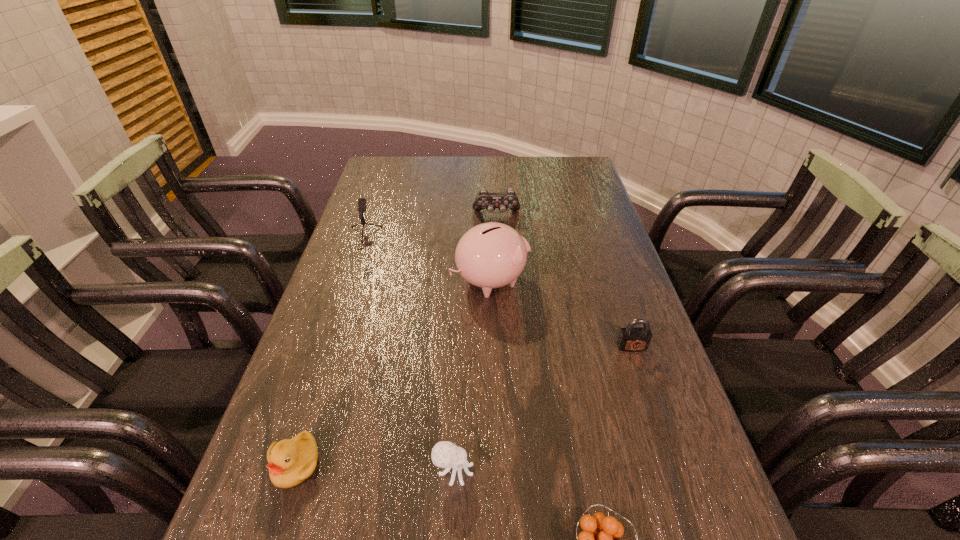
Locate an element on the screen. The image size is (960, 540). the tallest object is located at coordinates (490, 255).

This screenshot has width=960, height=540. In order to click on piggy bank in this screenshot , I will do `click(490, 255)`.

Find the location of a particular element. The image size is (960, 540). the sixth nearest object is located at coordinates 361,207.

The image size is (960, 540). Identify the location of control. (484, 199).

The width and height of the screenshot is (960, 540). Identify the location of the fourth farthest object. (631, 338).

In order to click on the rightmost object in this screenshot , I will do `click(631, 338)`.

Where is `octopus`? This screenshot has width=960, height=540. octopus is located at coordinates (445, 454).

Locate an element on the screen. This screenshot has width=960, height=540. duckling is located at coordinates (290, 461).

This screenshot has width=960, height=540. I want to click on free location located 0.230m on the back of the piggy bank, so click(x=489, y=216).

The height and width of the screenshot is (540, 960). What are the coordinates of `free point located 0.220m on the stand of the microphone` in the screenshot? It's located at (336, 313).